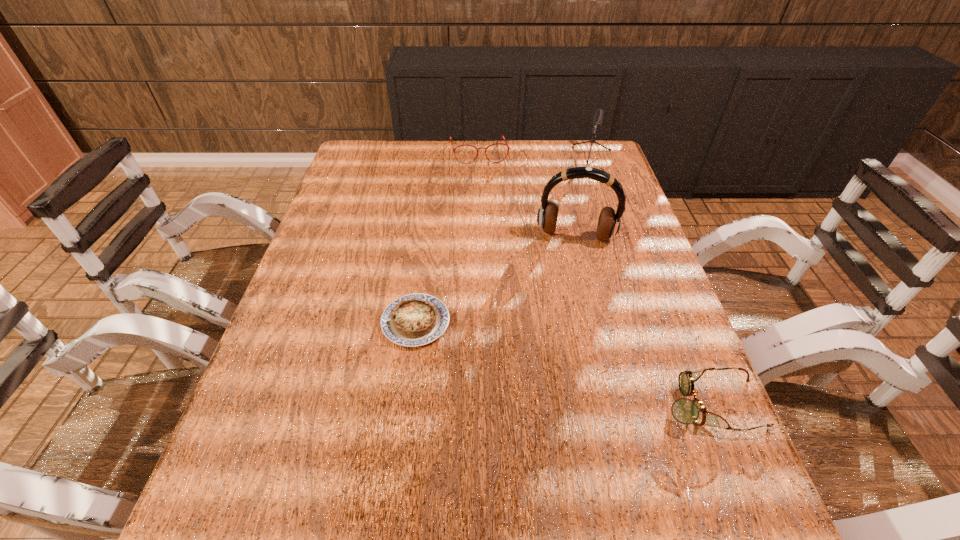
The width and height of the screenshot is (960, 540). In order to click on free space at the right edge in this screenshot , I will do `click(594, 195)`.

Locate an element on the screen. The width and height of the screenshot is (960, 540). free region at the far left corner of the desktop is located at coordinates (366, 166).

The height and width of the screenshot is (540, 960). In the image, there is a desktop. Identify the location of free space at the far right corner. [604, 147].

You are a GUI agent. You are given a task and a screenshot of the screen. Output one action in this format:
    pyautogui.click(x=<x>, y=<y>)
    Task: Click on the free space between the taller spectacles and the third farthest object
    The width and height of the screenshot is (960, 540).
    Given the screenshot: What is the action you would take?
    pos(527,194)

Where is `free spot between the farther spectacles and the quiche`? free spot between the farther spectacles and the quiche is located at coordinates (447, 237).

The width and height of the screenshot is (960, 540). Find the location of `empty space that is in between the nearest object and the quiche`. empty space that is in between the nearest object and the quiche is located at coordinates (563, 363).

Find the location of a particular element. free point between the microphone and the farther spectacles is located at coordinates (533, 157).

The height and width of the screenshot is (540, 960). In order to click on free spot between the right spectacles and the second tallest object in this screenshot , I will do `click(648, 283)`.

At what (x,y) coordinates should I click in order to perform the action: click on free space between the quiche and the tallest object. Please return your answer as a coordinate pair (x, y). Looking at the image, I should click on (495, 279).

The width and height of the screenshot is (960, 540). What are the coordinates of `empty space that is in between the fourth farthest object and the headset` in the screenshot? It's located at (495, 279).